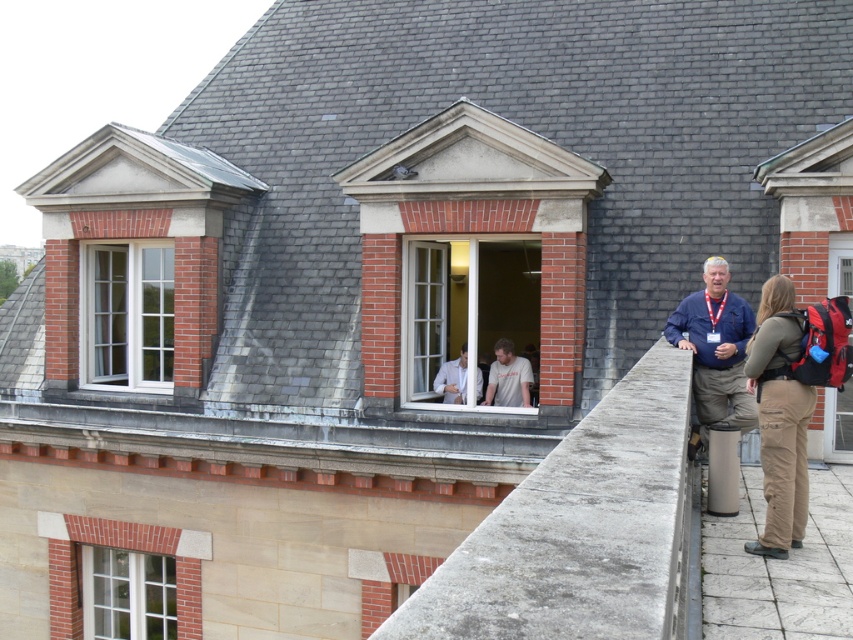
You are on the rooftop and see two pairs of khaki pants at right and khaki cotton pants at right. Which one is more to the right side?

The khaki pants at right is more to the right side.

You are a tailor examining two pairs of khaki pants on a rooftop. The khaki pants at right and the khaki cotton pants at right are both on display. Which pair has a narrower width?

The khaki pants at right has a lesser width compared to khaki cotton pants at right.

You are standing on the roof and want to see the view through the clear glass window at center. However, the light gray fabric shirt at center is blocking your view. Can you estimate if the window is narrow enough to see around the shirt?

The clear glass window at center is thinner than the light gray fabric shirt at center, so the window is narrower. Therefore, you can see around the light gray fabric shirt at center by moving slightly to the side.